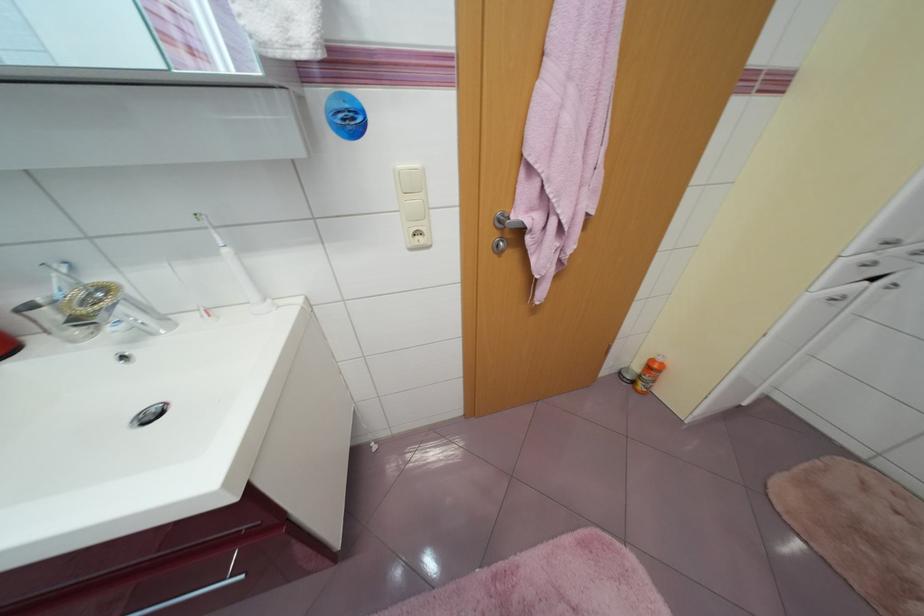
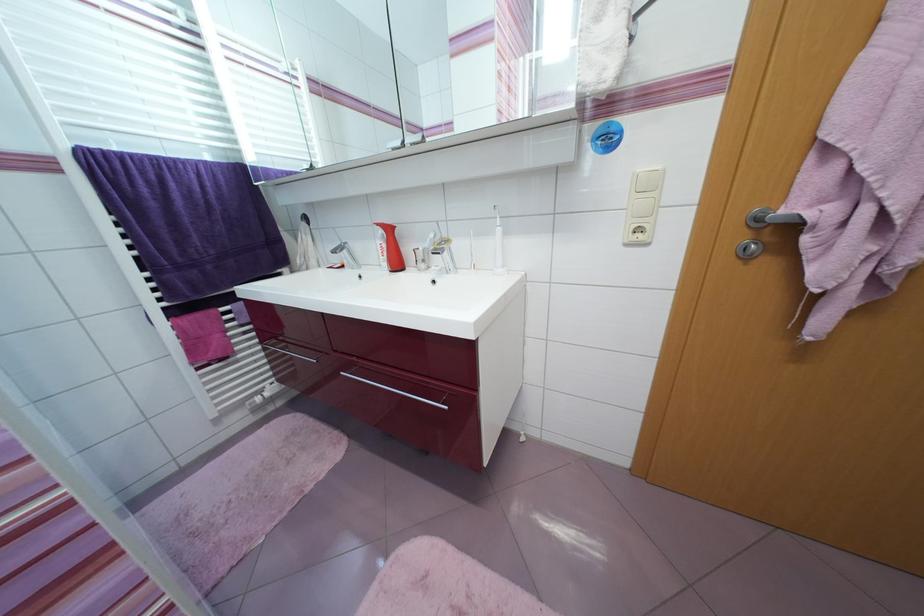
Where in the second image is the point corresponding to [500,237] from the first image?

(748, 238)